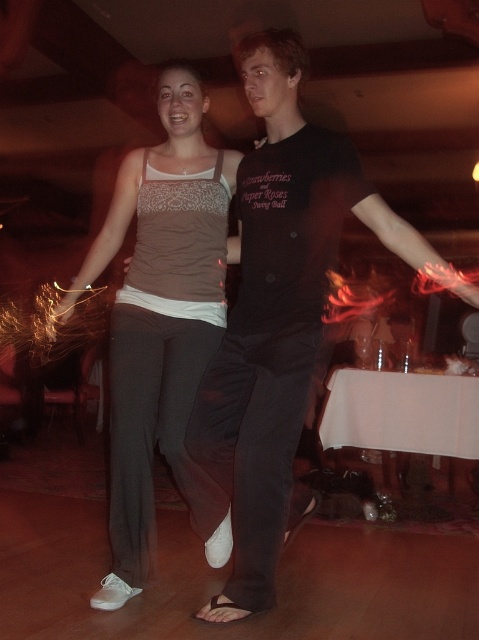
You are at a party and see two people in the center wearing the black cotton shirt at center and the matte gray tank top at center. Which one is positioned to the right?

The black cotton shirt at center is positioned to the right of the matte gray tank top at center.

You are a photographer at the event and need to capture a clear shot of the black cotton shirt at center and the matte gray tank top at center. Which one will appear more visible in the photo due to its position?

The black cotton shirt at center will appear more visible in the photo because it is positioned over the matte gray tank top at center, making it closer to the camera.